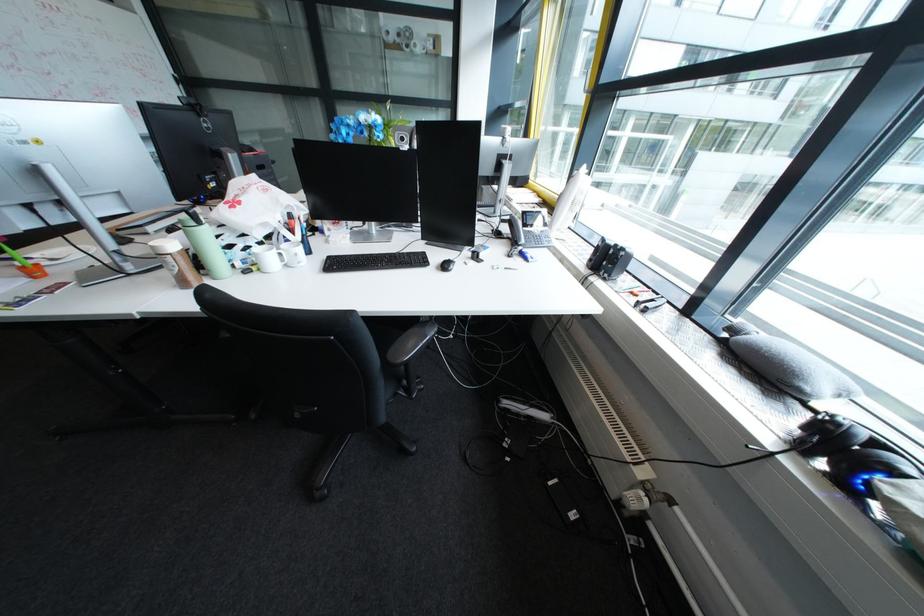
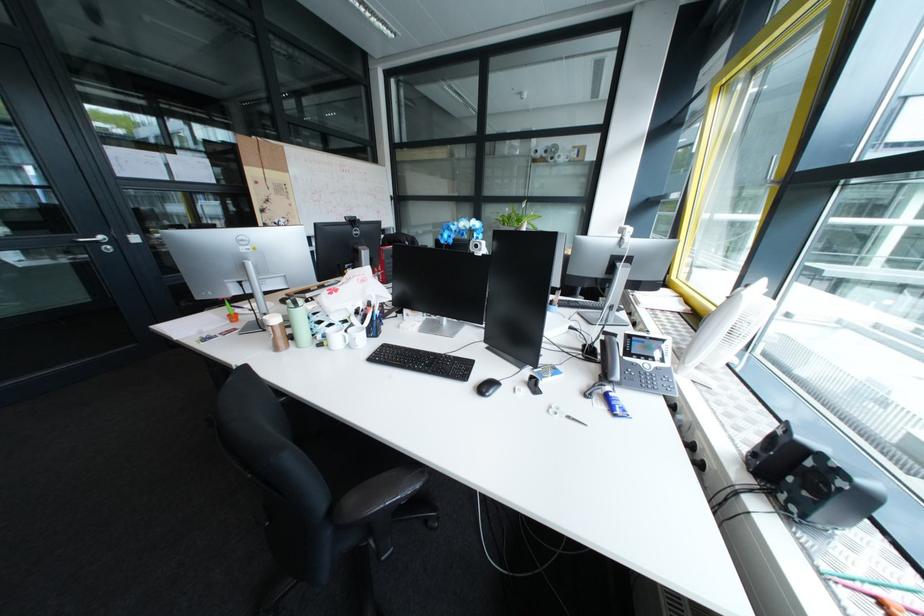
Where in the second image is the point corresponding to the point at 625,252 from the first image?

(823, 464)